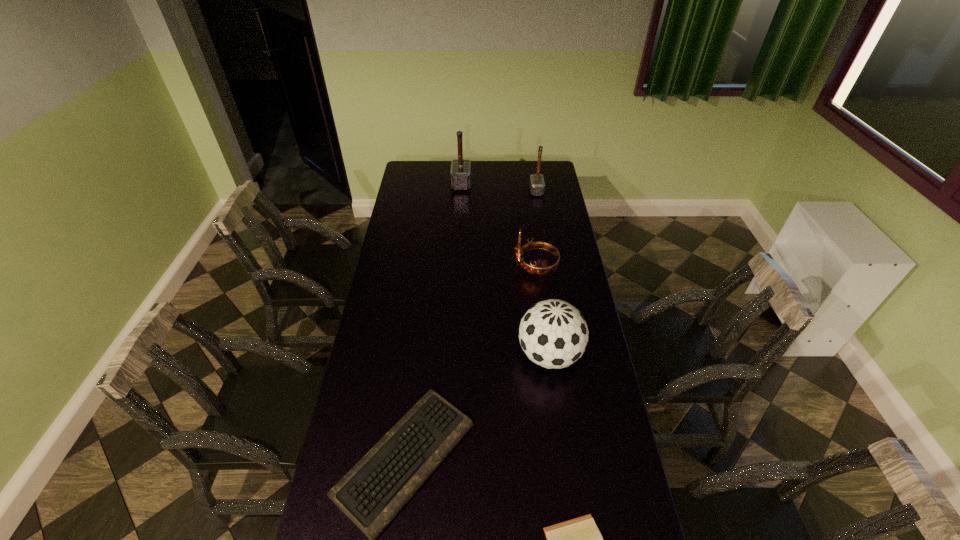
You are a GUI agent. You are given a task and a screenshot of the screen. Output one action in this format:
    pyautogui.click(x=<x>, y=<y>)
    Task: Click on the free spot between the soccer ball and the left hammer
    The image size is (960, 540).
    Given the screenshot: What is the action you would take?
    pyautogui.click(x=505, y=269)

Identify which object is the fourth nearest to the fourth nearest object. Please provide its 2D coordinates. Your answer should be formatted as a tuple, i.e. [(x, y)], where the tuple contains the x and y coordinates of a point satisfying the conditions above.

[(373, 492)]

You are a GUI agent. You are given a task and a screenshot of the screen. Output one action in this format:
    pyautogui.click(x=<x>, y=<y>)
    Task: Click on the fourth closest object to the fifth tallest object
    The image size is (960, 540).
    Given the screenshot: What is the action you would take?
    pyautogui.click(x=537, y=185)

At what (x,y) coordinates should I click in order to perform the action: click on free space in the image that satisfies the following two spatial constraints: 1. on the striking surface of the right hammer; 2. on the front side of the fourth farthest object. Please return your answer as a coordinate pair (x, y). This screenshot has width=960, height=540. Looking at the image, I should click on (564, 355).